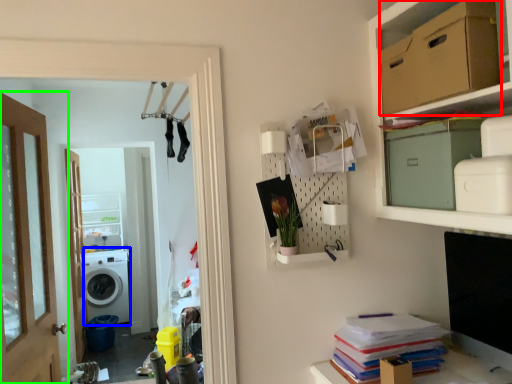
Question: Which object is positioned closest to cardboard box (highlighted by a red box)? Select from washing machine (highlighted by a blue box) and door (highlighted by a green box).

Choices:
 (A) washing machine
 (B) door

Answer: (B)